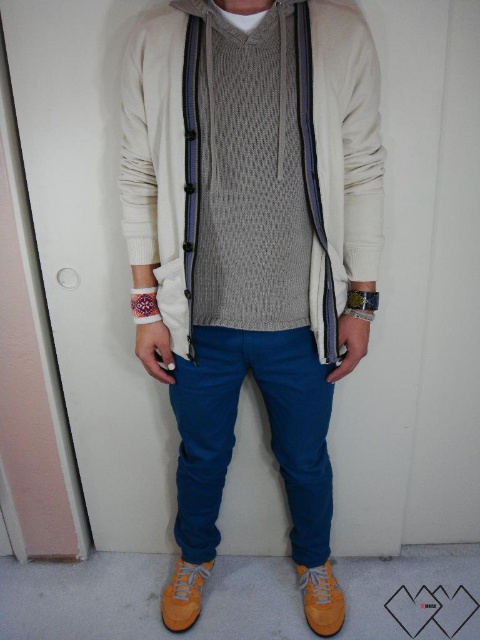
You are a delivery robot with a 3.5 feet long package. You need to place the package on the floor between you and the yellow suede shoe at lower center. Is there enough space to do so?

The distance between you and the yellow suede shoe at lower center is 4.75 feet. Since the package is 3.5 feet long, there is sufficient space to place it between you and the yellow suede shoe at lower center.

You are standing in a room with a person near a white door. You need to place a small object exactly at the point with coordinates point [321,598]. Which object from the scene should you avoid placing your item near?

The point [321,598] corresponds to the yellow suede shoe at lower center, so you should avoid placing the item near the yellow suede shoe at lower center to prevent obstruction.